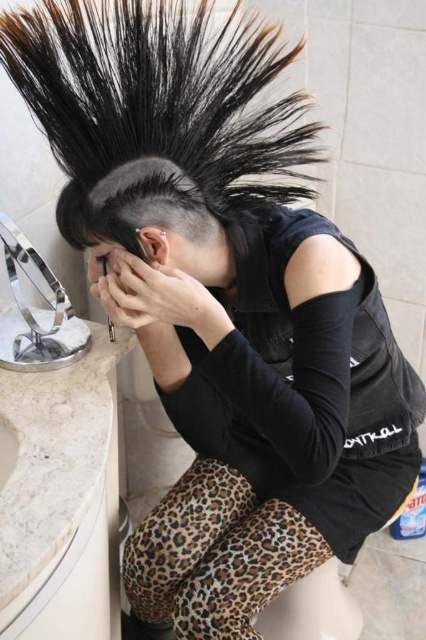
Can you confirm if black matte hair at upper center is wider than black matte shaved head at center?

Correct, the width of black matte hair at upper center exceeds that of black matte shaved head at center.

Who is more forward, [350,442] or [206,225]?

Point [206,225] is in front.

At what (x,y) coordinates should I click in order to perform the action: click on black matte hair at upper center. Please return your answer as a coordinate pair (x, y). The image size is (426, 640). Looking at the image, I should click on (249, 388).

Is black matte shaved head at center smaller than black matte hand at center?

Incorrect, black matte shaved head at center is not smaller in size than black matte hand at center.

How far apart are black matte shaved head at center and black matte hand at center?

black matte shaved head at center is 3.03 inches away from black matte hand at center.

Which is in front, point (215, 212) or point (126, 282)?

Point (126, 282) is in front.

This screenshot has width=426, height=640. Find the location of `black matte shaved head at center`. black matte shaved head at center is located at coordinates (135, 205).

Measure the distance between black matte hair at upper center and camera.

black matte hair at upper center and camera are 29.93 inches apart from each other.

Which is behind, point (112, 184) or point (201, 288)?

The point (201, 288) is more distant.

Find the location of a particular element. black matte hair at upper center is located at coordinates (249, 388).